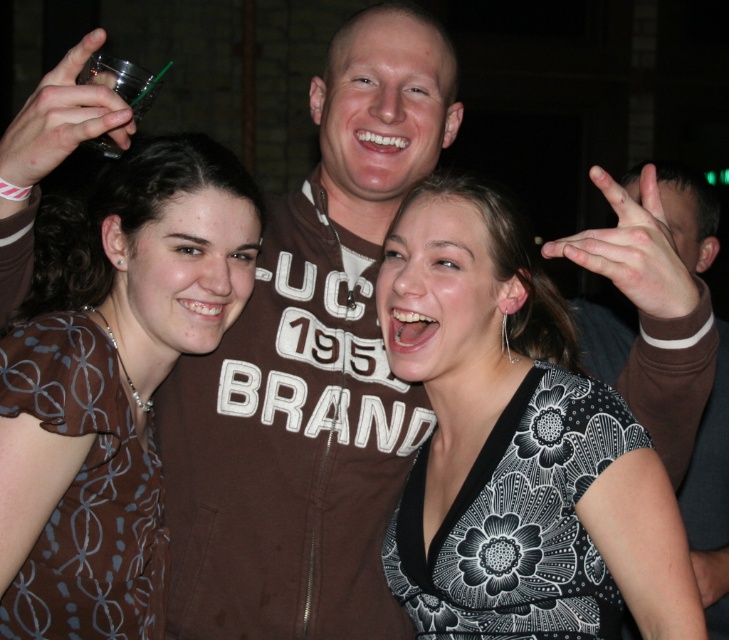
Describe the element at coordinates (515, 445) in the screenshot. I see `black floral dress at center` at that location.

Is point (483, 528) closer to viewer compared to point (63, 285)?

Yes, it is.

In order to click on black floral dress at center in this screenshot , I will do [x=515, y=445].

You are a GUI agent. You are given a task and a screenshot of the screen. Output one action in this format:
    pyautogui.click(x=<x>, y=<y>)
    Task: Click on the black floral dress at center
    
    Given the screenshot: What is the action you would take?
    pyautogui.click(x=515, y=445)

Between brown printed dress at center and clear plastic cup at upper left, which one appears on the left side from the viewer's perspective?

brown printed dress at center is more to the left.

Which is behind, point (36, 568) or point (122, 67)?

Point (36, 568)

Which is in front, point (128, 266) or point (139, 112)?

Point (139, 112)

Identify the location of brown printed dress at center. The height and width of the screenshot is (640, 729). (120, 371).

Between black floral dress at center and clear plastic cup at upper left, which one appears on the right side from the viewer's perspective?

Positioned to the right is black floral dress at center.

Image resolution: width=729 pixels, height=640 pixels. In order to click on black floral dress at center in this screenshot , I will do `click(515, 445)`.